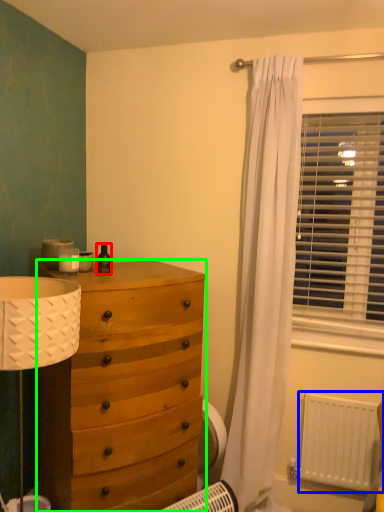
Question: Which object is the closest to the toiletry (highlighted by a red box)? Choose among these: radiator (highlighted by a blue box) or chest of drawers (highlighted by a green box).

Choices:
 (A) radiator
 (B) chest of drawers

Answer: (B)